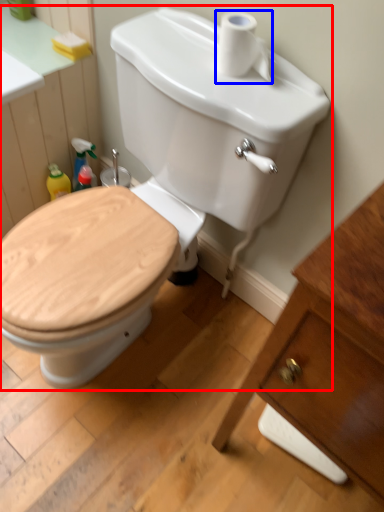
Question: Which object appears farthest to the camera in this image, toilet (highlighted by a red box) or toilet paper (highlighted by a blue box)?

Choices:
 (A) toilet
 (B) toilet paper

Answer: (B)